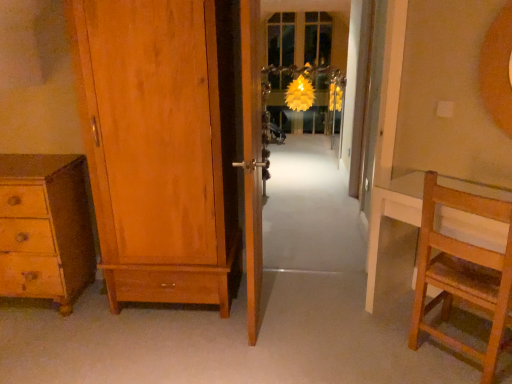
I want to click on space that is in front of wooden chest of drawers at lower left, so click(x=34, y=350).